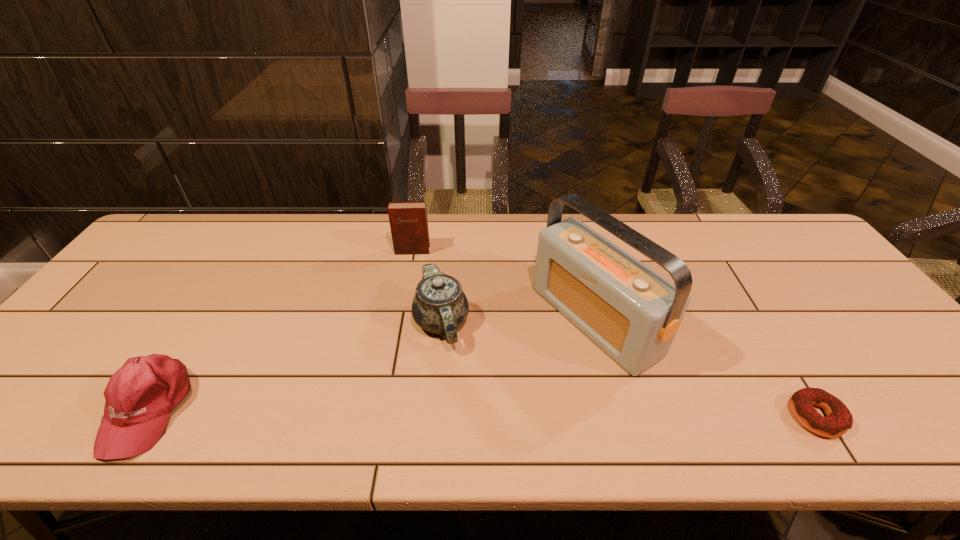
At what (x,y) coordinates should I click in order to perform the action: click on doughnut located at the near edge. Please return your answer as a coordinate pair (x, y). This screenshot has height=540, width=960. Looking at the image, I should click on pyautogui.click(x=839, y=419).

This screenshot has width=960, height=540. Find the location of `radio receiver that is positioned at the near edge`. radio receiver that is positioned at the near edge is located at coordinates (633, 313).

The image size is (960, 540). What are the coordinates of `vacant region at the far edge of the desktop` in the screenshot? It's located at (430, 233).

You are a GUI agent. You are given a task and a screenshot of the screen. Output one action in this format:
    pyautogui.click(x=<x>, y=<y>)
    Task: Click on the vacant area at the near edge of the desktop
    The width and height of the screenshot is (960, 540).
    Given the screenshot: What is the action you would take?
    pyautogui.click(x=572, y=388)

Locate an element on the screen. The image size is (960, 540). free space at the left edge is located at coordinates (115, 288).

This screenshot has width=960, height=540. I want to click on free spot at the far left corner of the desktop, so click(166, 249).

I want to click on blank space at the far right corner, so click(x=766, y=245).

The height and width of the screenshot is (540, 960). I want to click on blank space at the near right corner of the desktop, so click(878, 376).

Where is `empty location between the diary and the tallest object`? Image resolution: width=960 pixels, height=540 pixels. empty location between the diary and the tallest object is located at coordinates (503, 286).

The width and height of the screenshot is (960, 540). I want to click on empty location between the baseball cap and the chinaware, so click(295, 366).